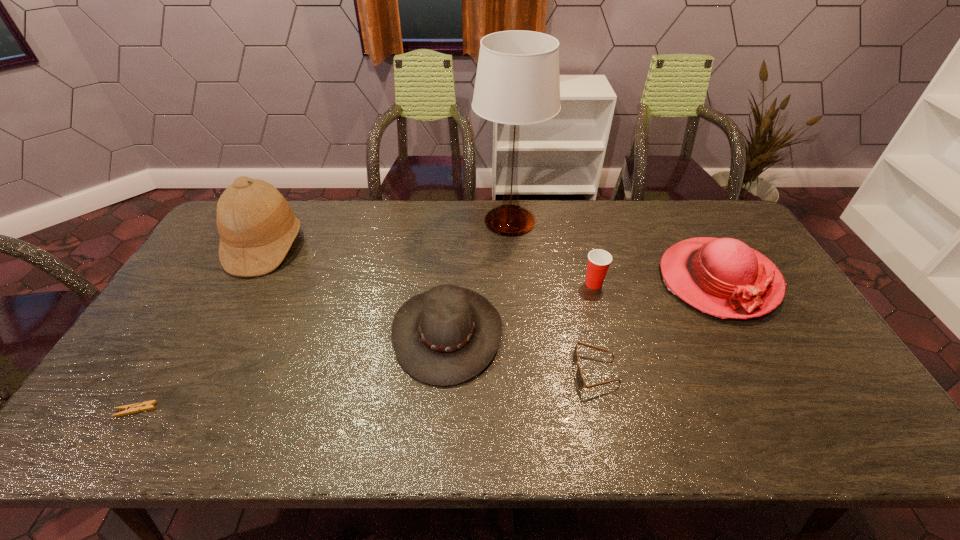
What are the coordinates of `vacant space at the left edge of the desktop` in the screenshot? It's located at point(200,259).

Where is `free space at the right edge of the desktop`? free space at the right edge of the desktop is located at coordinates coord(772,366).

The width and height of the screenshot is (960, 540). Find the location of `free space at the far right corner of the desktop`. free space at the far right corner of the desktop is located at coordinates (701, 202).

Image resolution: width=960 pixels, height=540 pixels. I want to click on vacant point located between the second hat from right to left and the Dixie cup, so click(x=520, y=308).

At what (x,y) coordinates should I click in order to perform the action: click on blank region between the leftmost hat and the second hat from left to right. Please return your answer as a coordinate pair (x, y). The image size is (960, 540). Looking at the image, I should click on coord(356,289).

Identify the location of unoccupied position between the Dixie cup and the rightmost hat. This screenshot has height=540, width=960. (656, 282).

The width and height of the screenshot is (960, 540). I want to click on free space between the rightmost object and the sixth shortest object, so click(492, 263).

Locate an element on the screen. empty space between the tallest object and the nearest object is located at coordinates (323, 315).

Identify the location of free space between the table lamp and the second shortest object. The width and height of the screenshot is (960, 540). (553, 296).

Identify the location of vacant space that is in between the tallest object and the sixth tallest object. (553, 296).